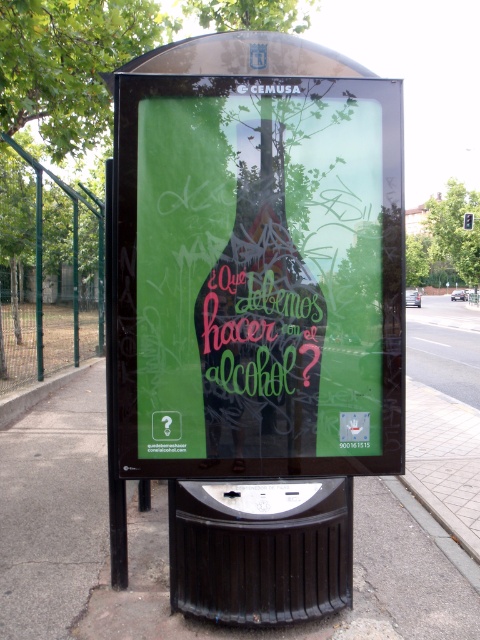
Between black asphalt pavement at lower center and neon green glass bottle at center, which one has more height?

neon green glass bottle at center

Is black asphalt pavement at lower center positioned before neon green glass bottle at center?

No, it is not.

Is point (81, 604) positioned behind point (279, 266)?

Yes, point (81, 604) is farther from viewer.

The image size is (480, 640). Find the location of `black asphalt pavement at lower center`. black asphalt pavement at lower center is located at coordinates (167, 548).

Which is more to the right, green matte poster at center or neon green glass bottle at center?

From the viewer's perspective, neon green glass bottle at center appears more on the right side.

Between green matte poster at center and neon green glass bottle at center, which one appears on the left side from the viewer's perspective?

From the viewer's perspective, green matte poster at center appears more on the left side.

The width and height of the screenshot is (480, 640). In order to click on green matte poster at center in this screenshot , I will do `click(253, 314)`.

How distant is green matte poster at center from black asphalt pavement at lower center?

green matte poster at center and black asphalt pavement at lower center are 1.69 meters apart.

Which is below, green matte poster at center or black asphalt pavement at lower center?

Positioned lower is black asphalt pavement at lower center.

Who is more distant from viewer, (x=338, y=291) or (x=400, y=582)?

The point (x=400, y=582) is more distant.

This screenshot has width=480, height=640. Find the location of `green matte poster at center`. green matte poster at center is located at coordinates (253, 314).